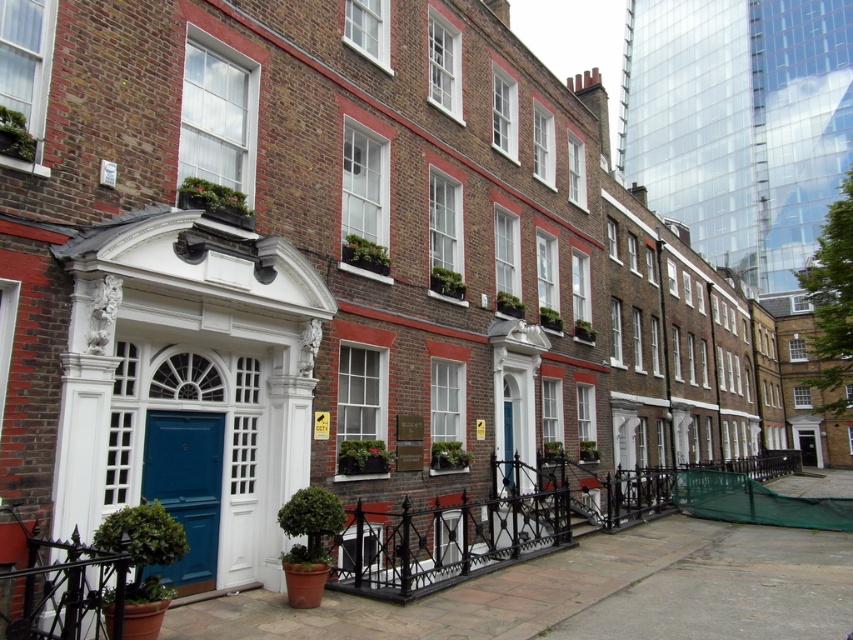
Measure the distance between black wrought iron fence at center and camera.

black wrought iron fence at center and camera are 12.22 meters apart from each other.

Does black wrought iron fence at center appear on the right side of blue glossy door at center?

Yes, black wrought iron fence at center is to the right of blue glossy door at center.

Between point (419, 513) and point (148, 419), which one is positioned in front?

Point (148, 419)

Find the location of a particular element. black wrought iron fence at center is located at coordinates (508, 522).